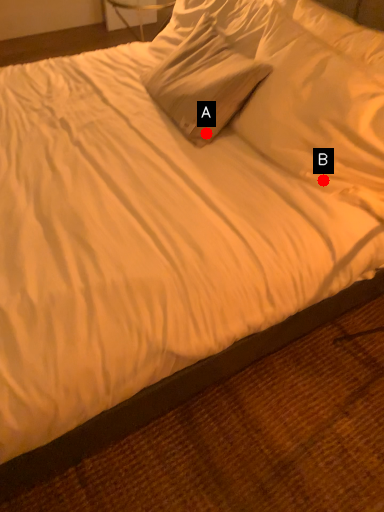
Question: Two points are circled on the image, labeled by A and B beside each circle. Which point appears farthest from the camera in this image?

Choices:
 (A) A is further
 (B) B is further

Answer: (A)